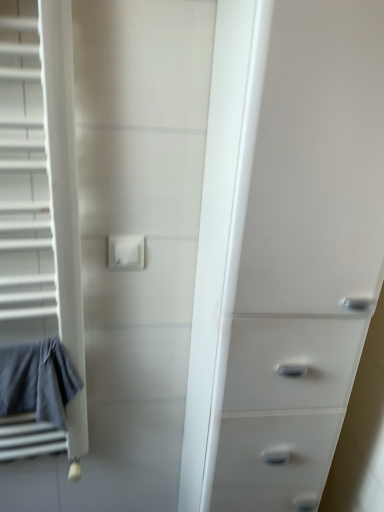
Locate an element on the screen. Image resolution: width=384 pixels, height=512 pixels. white plastic chest of drawers at right is located at coordinates (283, 249).

Find the location of a particular element. Image resolution: width=384 pixels, height=512 pixels. gray cotton bath towel at left is located at coordinates (38, 380).

In order to face white plastic electric outlet at center, should I rotate leftwards or rightwards?

A 8.871 degree turn to the left will do.

Where is `white plastic chest of drawers at right`? white plastic chest of drawers at right is located at coordinates (283, 249).

Between white plastic electric outlet at center and gray cotton bath towel at left, which one has larger width?

With larger width is gray cotton bath towel at left.

Does point (119, 261) appear closer or farther from the camera than point (28, 386)?

Point (119, 261) is positioned closer to the camera compared to point (28, 386).

From a real-world perspective, is white plastic electric outlet at center above or below gray cotton bath towel at left?

white plastic electric outlet at center is above gray cotton bath towel at left.

Which of these two, white plastic electric outlet at center or gray cotton bath towel at left, stands shorter?

Standing shorter between the two is white plastic electric outlet at center.

Can you confirm if gray cotton bath towel at left is bigger than white plastic chest of drawers at right?

Incorrect, gray cotton bath towel at left is not larger than white plastic chest of drawers at right.

Which is in front, point (7, 385) or point (232, 120)?

The point (232, 120) is closer to the camera.

Considering the sizes of gray cotton bath towel at left and white plastic chest of drawers at right in the image, is gray cotton bath towel at left wider or thinner than white plastic chest of drawers at right?

In the image, gray cotton bath towel at left appears to be more narrow than white plastic chest of drawers at right.

From the image's perspective, is gray cotton bath towel at left above or below white plastic chest of drawers at right?

gray cotton bath towel at left is below white plastic chest of drawers at right.

Identify the location of bath towel that appears below the white plastic chest of drawers at right (from the image's perspective). The height and width of the screenshot is (512, 384). (38, 380).

What's the angular difference between white plastic chest of drawers at right and gray cotton bath towel at left's facing directions?

The angular difference between white plastic chest of drawers at right and gray cotton bath towel at left is 0.00382 degrees.

From a real-world perspective, is white plastic chest of drawers at right physically above gray cotton bath towel at left?

Yes, from a real-world perspective, white plastic chest of drawers at right is over gray cotton bath towel at left

Does point (23, 366) lie in front of point (118, 249)?

Yes, point (23, 366) is in front of point (118, 249).

Measure the distance from gray cotton bath towel at left to white plastic electric outlet at center.

gray cotton bath towel at left and white plastic electric outlet at center are 12.68 inches apart.

From the image's perspective, which one is positioned higher, gray cotton bath towel at left or white plastic electric outlet at center?

white plastic electric outlet at center is shown above in the image.

At what (x,y) coordinates should I click in order to perform the action: click on bath towel below the white plastic electric outlet at center (from a real-world perspective). Please return your answer as a coordinate pair (x, y). Looking at the image, I should click on (38, 380).

From the image's perspective, who appears lower, white plastic electric outlet at center or white plastic chest of drawers at right?

From the image's view, white plastic chest of drawers at right is below.

What's the angular difference between white plastic electric outlet at center and white plastic chest of drawers at right's facing directions?

There is a 1.37-degree angle between the facing directions of white plastic electric outlet at center and white plastic chest of drawers at right.

Considering the relative sizes of white plastic electric outlet at center and white plastic chest of drawers at right in the image provided, is white plastic electric outlet at center taller than white plastic chest of drawers at right?

No, white plastic electric outlet at center is not taller than white plastic chest of drawers at right.

Measure the distance from white plastic electric outlet at center to white plastic chest of drawers at right.

white plastic electric outlet at center and white plastic chest of drawers at right are 17.60 inches apart.

Is point (343, 153) closer or farther from the camera than point (124, 259)?

Point (343, 153) appears to be closer to the viewer than point (124, 259).

In the scene shown: Is white plastic chest of drawers at right not near white plastic electric outlet at center?

white plastic chest of drawers at right is near white plastic electric outlet at center, not far away.

Considering the sizes of white plastic chest of drawers at right and white plastic electric outlet at center in the image, is white plastic chest of drawers at right wider or thinner than white plastic electric outlet at center?

white plastic chest of drawers at right is wider than white plastic electric outlet at center.

Where is `bath towel below the white plastic electric outlet at center (from the image's perspective)`? Image resolution: width=384 pixels, height=512 pixels. bath towel below the white plastic electric outlet at center (from the image's perspective) is located at coordinates (38, 380).

The width and height of the screenshot is (384, 512). I want to click on the chest of drawers in front of the gray cotton bath towel at left, so click(283, 249).

Looking at the image, which one is located closer to white plastic chest of drawers at right, white plastic electric outlet at center or gray cotton bath towel at left?

white plastic electric outlet at center is closer to white plastic chest of drawers at right.

Based on their spatial positions, is gray cotton bath towel at left or white plastic chest of drawers at right closer to white plastic electric outlet at center?

gray cotton bath towel at left lies closer to white plastic electric outlet at center than the other object.

Based on their spatial positions, is gray cotton bath towel at left or white plastic electric outlet at center further from white plastic chest of drawers at right?

gray cotton bath towel at left lies further to white plastic chest of drawers at right than the other object.

Which object lies further to the anchor point gray cotton bath towel at left, white plastic electric outlet at center or white plastic chest of drawers at right?

Among the two, white plastic chest of drawers at right is located further to gray cotton bath towel at left.

From the image, which object appears to be farther from gray cotton bath towel at left, white plastic chest of drawers at right or white plastic electric outlet at center?

white plastic chest of drawers at right is positioned further to the anchor gray cotton bath towel at left.

From the image, which object appears to be nearer to white plastic electric outlet at center, white plastic chest of drawers at right or gray cotton bath towel at left?

gray cotton bath towel at left is closer to white plastic electric outlet at center.

At what (x,y) coordinates should I click in order to perform the action: click on electric outlet between gray cotton bath towel at left and white plastic chest of drawers at right. Please return your answer as a coordinate pair (x, y). This screenshot has height=512, width=384. Looking at the image, I should click on (126, 252).